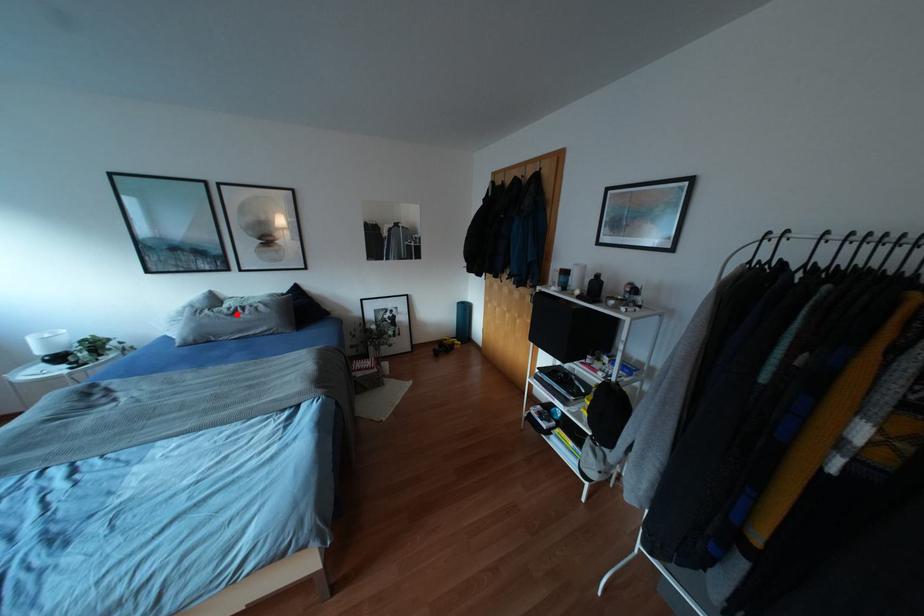
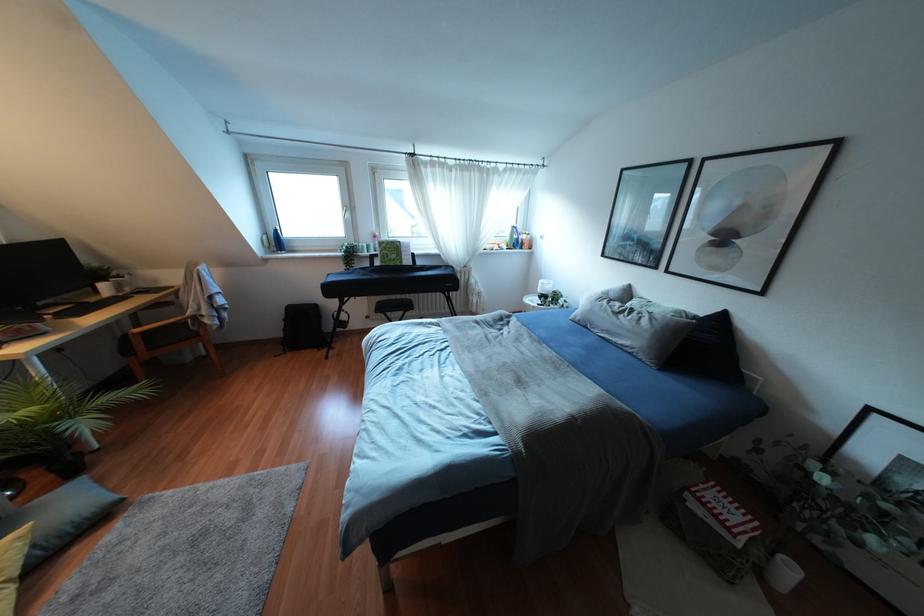
In the second image, find the point that corresponds to the highlighted location in the first image.

(619, 315)